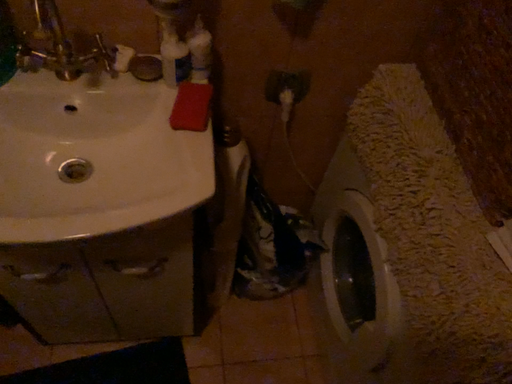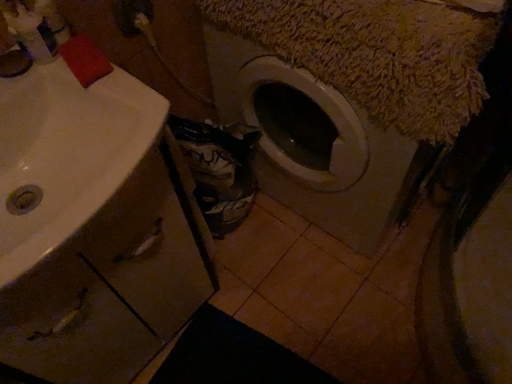
Question: How did the camera likely rotate when shooting the video?

Choices:
 (A) rotated left
 (B) rotated right

Answer: (B)